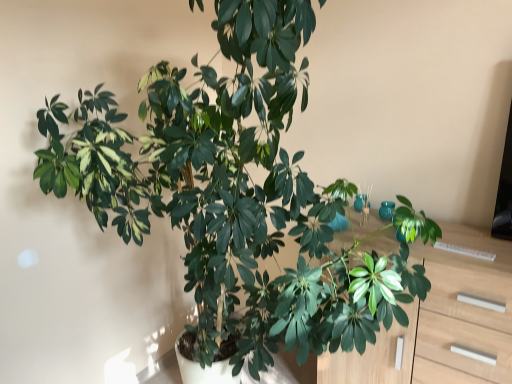
This screenshot has height=384, width=512. I want to click on wooden dresser at center, so tap(442, 320).

Based on the photo, measure the distance between point (454, 294) and camera.

Point (454, 294) and camera are 4.73 feet apart from each other.

This screenshot has height=384, width=512. Describe the element at coordinates (442, 320) in the screenshot. I see `wooden dresser at center` at that location.

This screenshot has height=384, width=512. What are the coordinates of `wooden dresser at center` in the screenshot? It's located at (442, 320).